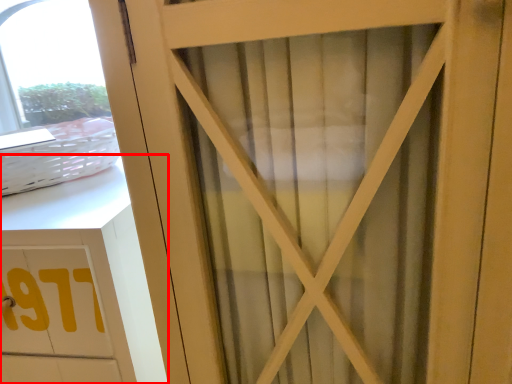
Question: From the image's perspective, what is the correct spatial relationship of cabinetry (annotated by the red box) in relation to basket?

Choices:
 (A) above
 (B) below

Answer: (B)